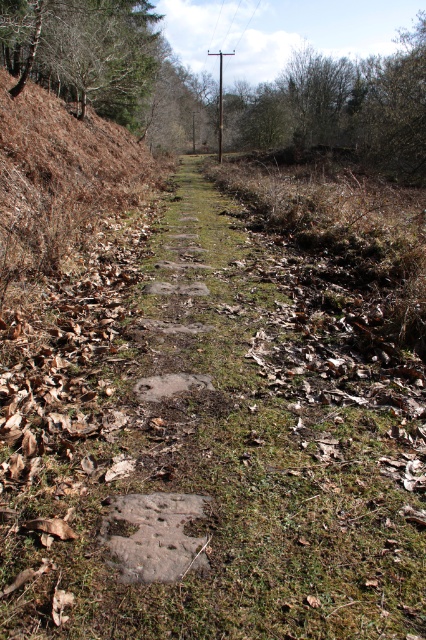
Does brown leafy tree at upper center have a smaller size compared to brown wooden telegraph pole at center?

No.

Identify the location of brown leafy tree at upper center. click(x=348, y=106).

Looking at this image, between brown bark tree at upper left and brown wooden telegraph pole at center, which one is positioned higher?

Positioned higher is brown wooden telegraph pole at center.

Does point (95, 42) come closer to viewer compared to point (219, 138)?

Yes.

The image size is (426, 640). In order to click on brown bark tree at upper left in this screenshot , I will do `click(83, 51)`.

From the picture: Between brown leafy tree at upper center and brown bark tree at upper left, which one is positioned lower?

brown bark tree at upper left is below.

Is point (296, 60) positioned after point (115, 83)?

That is True.

I want to click on brown leafy tree at upper center, so click(x=348, y=106).